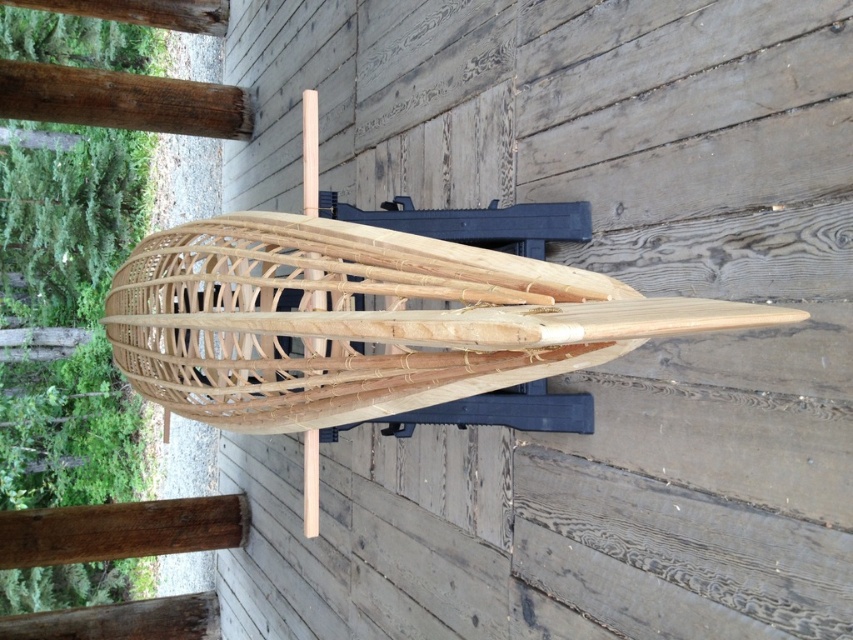
You are a carpenter working on a project and need to place a 24 inch tool box between the natural wood boat at center and another object. Can you fit it there?

The distance between the natural wood boat at center and the other object is 25.63 inches, so the 24 inch tool box can fit between them since it is shorter than the available space.

You are a carpenter assessing the space needed for a new project. You have a natural wood boat at center and a brown wood beam at upper left in your workshop. Which object requires more horizontal space to accommodate its width?

The natural wood boat at center requires more horizontal space because its width is larger than the brown wood beam at upper left.